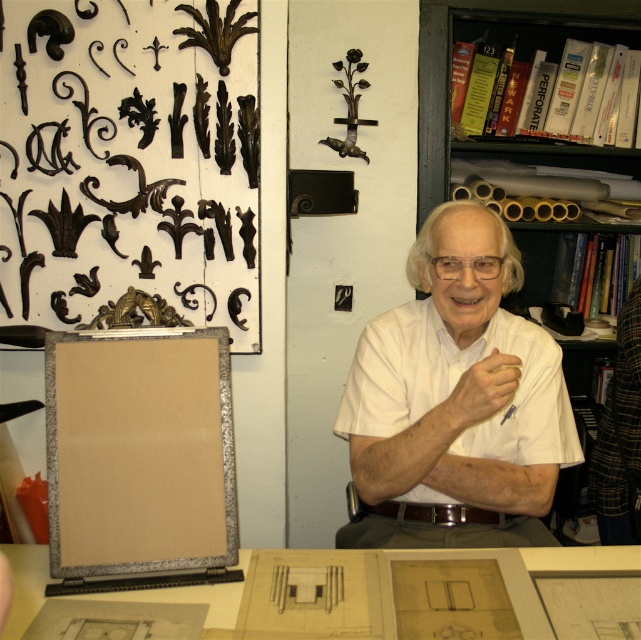
Question: Which point is farther from the camera taking this photo?

Choices:
 (A) tap(367, 538)
 (B) tap(426, 129)
 (C) tap(203, 595)

Answer: (B)

Question: Is green matte bookcase at upper right further to camera compared to matte paper table at lower center?

Choices:
 (A) yes
 (B) no

Answer: (A)

Question: Estimate the real-world distances between objects in this image. Which object is farther from the matte paper table at lower center?

Choices:
 (A) white matte shirt at center
 (B) green matte bookcase at upper right

Answer: (B)

Question: Based on their relative distances, which object is nearer to the matte paper table at lower center?

Choices:
 (A) green matte bookcase at upper right
 (B) white matte shirt at center

Answer: (B)

Question: Does white matte shirt at center have a larger size compared to matte paper table at lower center?

Choices:
 (A) yes
 (B) no

Answer: (A)

Question: Is white matte shirt at center behind matte paper table at lower center?

Choices:
 (A) yes
 (B) no

Answer: (A)